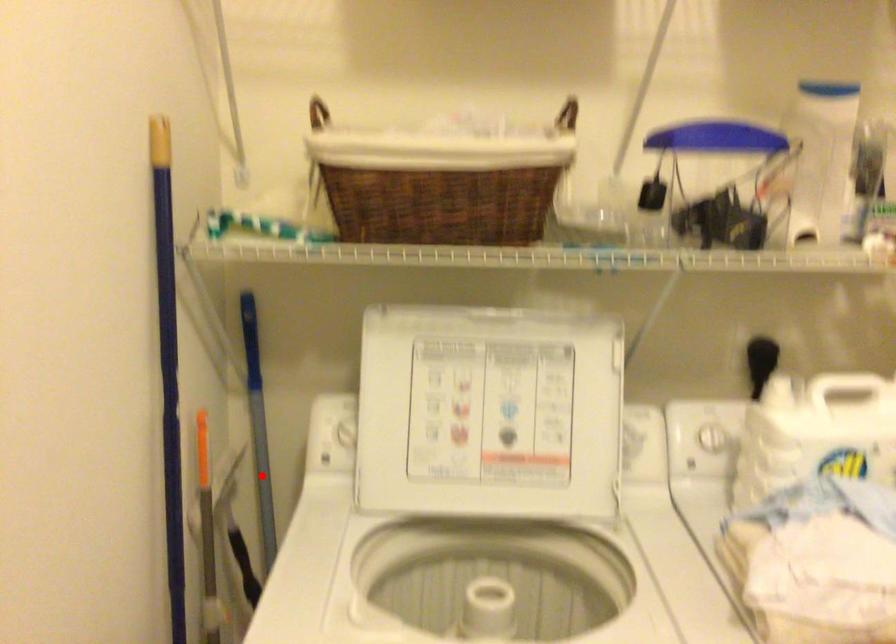
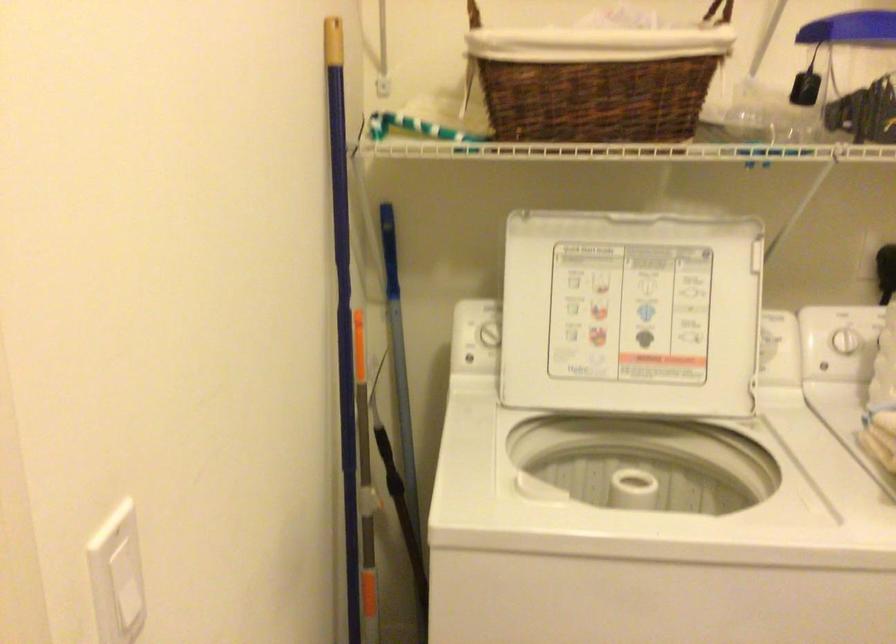
Locate, in the second image, the point that corresponds to the highlighted location in the first image.

(400, 379)